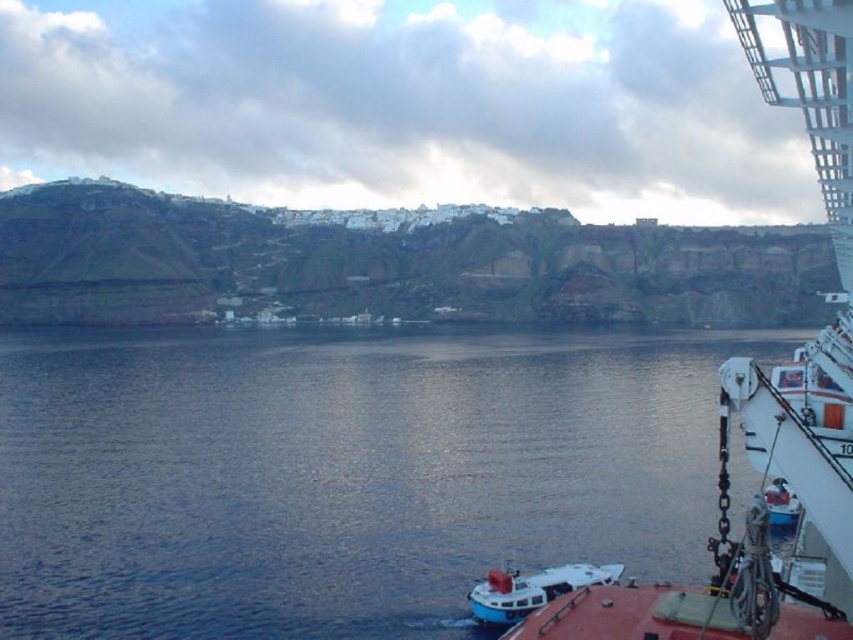
Looking at this image, who is more distant from viewer, (x=183, y=314) or (x=810, y=468)?

The point (x=183, y=314) is more distant.

Is point (485, 276) positioned after point (798, 3)?

Yes, it is.

Measure the distance between point (599, 308) and camera.

Point (599, 308) and camera are 198.56 meters apart.

What are the coordinates of `green grassy hillside at upper left` in the screenshot? It's located at (387, 262).

Can you confirm if green grassy hillside at upper left is positioned below white matte boat at lower center?

No.

The image size is (853, 640). Find the location of `green grassy hillside at upper left`. green grassy hillside at upper left is located at coordinates (387, 262).

This screenshot has width=853, height=640. I want to click on green grassy hillside at upper left, so click(387, 262).

Between dark blue water at lower left and white glossy cruise ship at right, which one is positioned higher?

Positioned higher is white glossy cruise ship at right.

Who is positioned more to the right, dark blue water at lower left or white glossy cruise ship at right?

white glossy cruise ship at right is more to the right.

Is point (473, 340) closer to camera compared to point (753, 67)?

No, (473, 340) is further to viewer.

In order to click on dark blue water at lower left in this screenshot , I will do `click(341, 472)`.